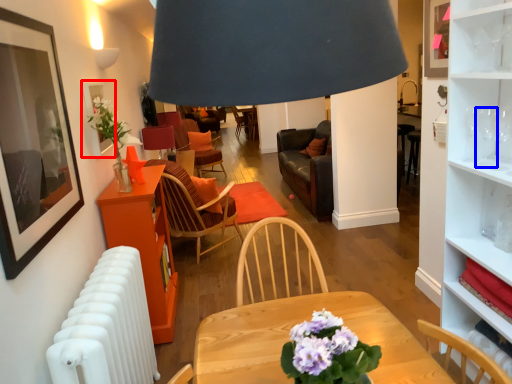
Question: Which of the following is the farthest to the observer, picture frame (highlighted by a red box) or wine glass (highlighted by a blue box)?

Choices:
 (A) picture frame
 (B) wine glass

Answer: (A)